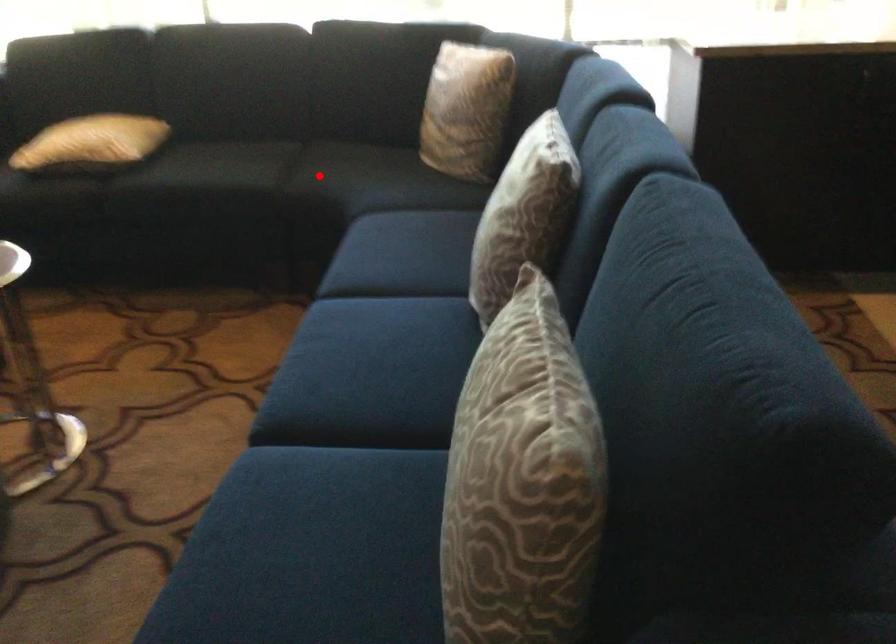
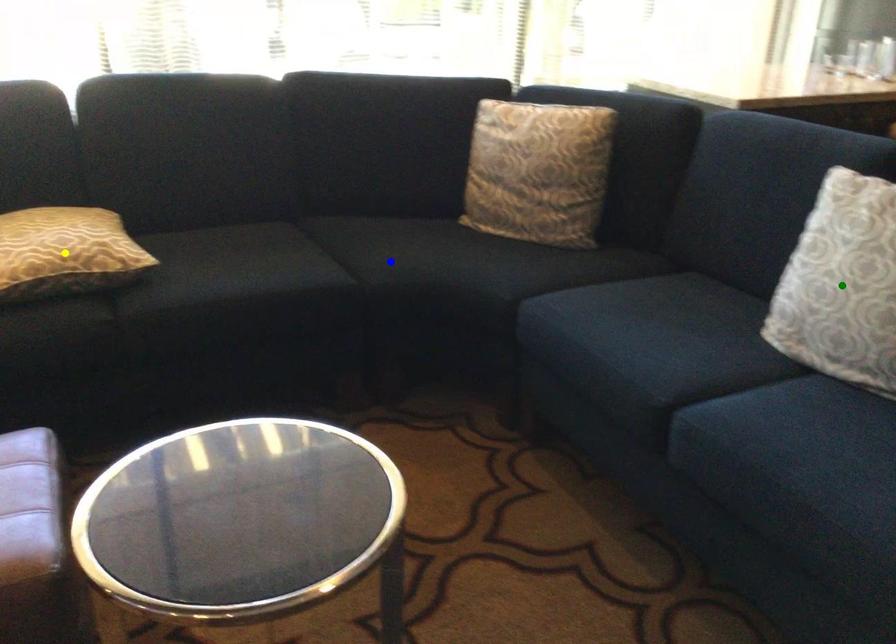
Question: I am providing you with two images of the same scene from different viewpoints. A red point is marked on the first image. You are given multiple points on the second image. Can you choose the point in image 2 that corresponds to the point in image 1?

Choices:
 (A) blue point
 (B) green point
 (C) yellow point

Answer: (A)